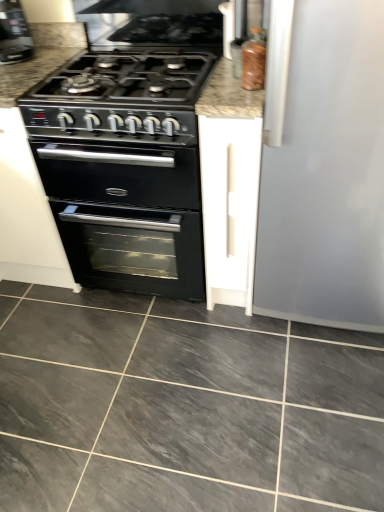
Question: From a real-world perspective, is gray marble floor at center above or below black matte oven at center?

Choices:
 (A) above
 (B) below

Answer: (B)

Question: Is point (352, 340) positioned closer to the camera than point (188, 268)?

Choices:
 (A) closer
 (B) farther

Answer: (A)

Question: Which is nearer to the marble countertop at center?

Choices:
 (A) white matte cabinet at center
 (B) black plastic coffee machine at upper left
 (C) gray marble floor at center
 (D) translucent amber bottle at upper right
 (E) black matte oven at center

Answer: (B)

Question: Based on their relative distances, which object is nearer to the marble countertop at center?

Choices:
 (A) white matte cabinet at center
 (B) gray marble floor at center
 (C) black plastic coffee machine at upper left
 (D) translucent amber bottle at upper right
 (E) black matte oven at center

Answer: (C)